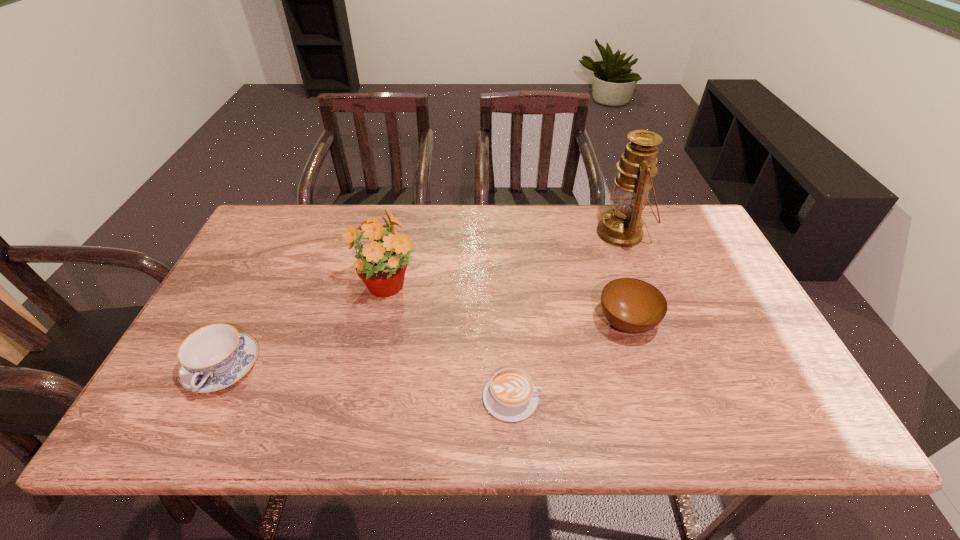
Locate an element on the screen. vacant space at the left edge of the desktop is located at coordinates (163, 388).

The width and height of the screenshot is (960, 540). Identify the location of vacant space at the right edge. (708, 330).

Where is `free space at the far left corner of the desktop`? This screenshot has width=960, height=540. free space at the far left corner of the desktop is located at coordinates (300, 206).

This screenshot has width=960, height=540. In the image, there is a desktop. In order to click on vacant area at the far right corner in this screenshot , I will do `click(682, 213)`.

Find the location of a particular element. vacant space in between the chinaware and the cappuccino is located at coordinates (367, 382).

Locate an element on the screen. The height and width of the screenshot is (540, 960). vacant space that's between the leftmost object and the bowl is located at coordinates (424, 346).

This screenshot has width=960, height=540. I want to click on free space that is in between the flowerpot and the chinaware, so click(305, 328).

This screenshot has width=960, height=540. Identify the location of free space between the shortest object and the flowerpot. (450, 343).

Where is `vacant area that lies between the leftmost object and the third object from left to right`? The image size is (960, 540). vacant area that lies between the leftmost object and the third object from left to right is located at coordinates (367, 382).

You are a GUI agent. You are given a task and a screenshot of the screen. Output one action in this format:
    pyautogui.click(x=<x>, y=<y>)
    Task: Click on the empty space that is in between the flowerpot and the third object from left to right
    Image resolution: width=960 pixels, height=540 pixels.
    Given the screenshot: What is the action you would take?
    pyautogui.click(x=450, y=343)